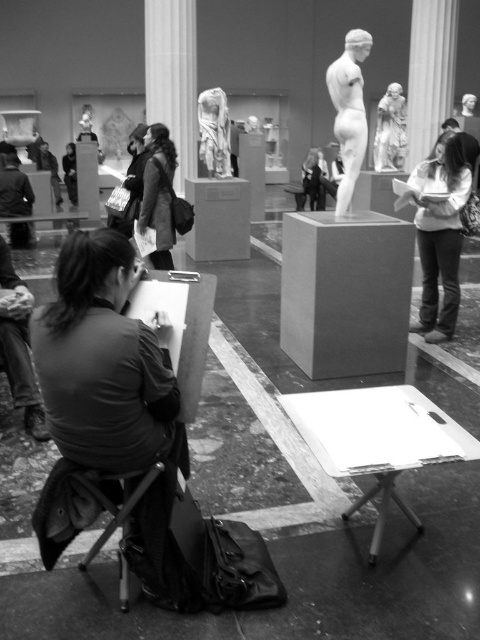
Question: Which object is positioned closest to the dark brown leather jacket at upper center?

Choices:
 (A) white marble statue at center
 (B) matte white statue at upper center
 (C) smooth marble statue at upper right
 (D) matte black jacket at center

Answer: (A)

Question: Is smooth beige sweater at center further to the viewer compared to dark brown leather jacket at upper center?

Choices:
 (A) no
 (B) yes

Answer: (A)

Question: Is dark brown leather jacket at upper center bigger than matte black jacket at center?

Choices:
 (A) no
 (B) yes

Answer: (A)

Question: Does dark brown leather jacket at upper center appear on the right side of smooth marble statue at upper right?

Choices:
 (A) no
 (B) yes

Answer: (A)

Question: Which is nearer to the smooth marble statue at upper right?

Choices:
 (A) smooth beige sweater at center
 (B) white marble statue at center

Answer: (B)

Question: Which is farther from the dark brown leather jacket at upper center?

Choices:
 (A) matte black jacket at center
 (B) matte white statue at upper center
 (C) smooth beige sweater at center

Answer: (A)